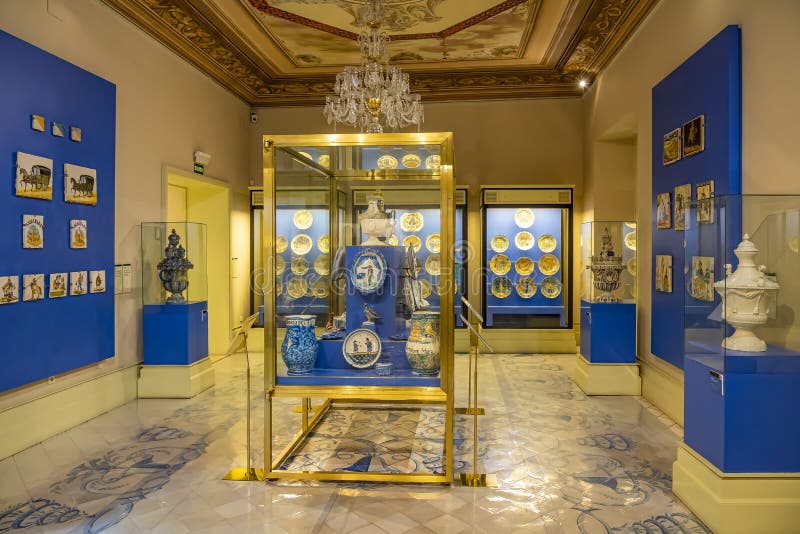
What are the coordinates of `wall` in the screenshot? It's located at (150, 123), (493, 132), (768, 121).